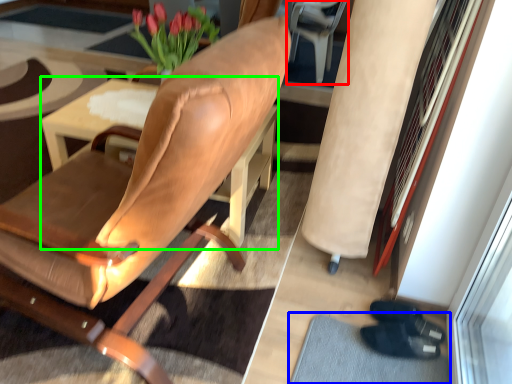
Question: Based on their relative distances, which object is nearer to armchair (highlighted by a red box)? Choose from doormat (highlighted by a blue box) and table (highlighted by a green box).

Choices:
 (A) doormat
 (B) table

Answer: (B)